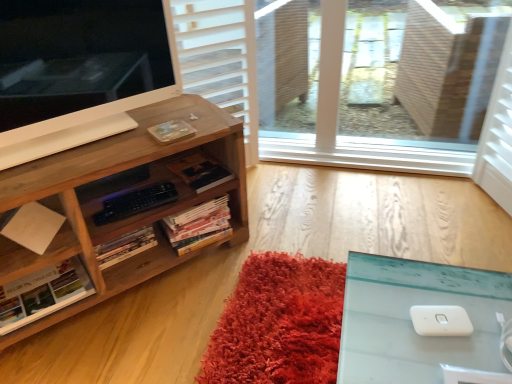
Where is `free space in front of white glossy computer monitor at upper left`? Image resolution: width=512 pixels, height=384 pixels. free space in front of white glossy computer monitor at upper left is located at coordinates (70, 156).